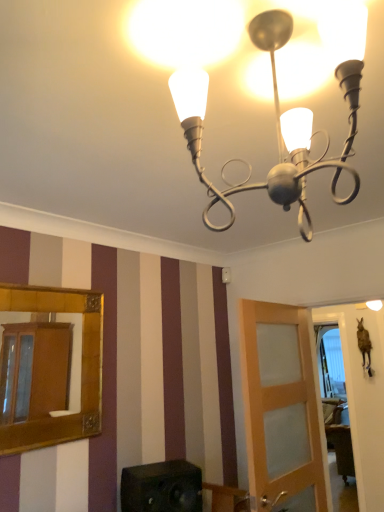
In order to face metallic silver chandelier at upper center, should I rotate leftwards or rightwards?

You should look right and rotate roughly 12.749 degrees.

Looking at this image, measure the distance between point (352, 115) and camera.

The depth of point (352, 115) is 29.53 inches.

In order to face transparent glass window at center, should I rotate leftwards or rightwards?

Rotate right and turn 18.726 degrees.

The image size is (384, 512). Identify the location of black matte speaker at lower center. (162, 487).

Between gold-framed mirror at left and black matte speaker at lower center, which one has less height?

black matte speaker at lower center.

From the image's perspective, between gold-framed mirror at left and black matte speaker at lower center, who is located below?

black matte speaker at lower center is shown below in the image.

Is gold-framed mirror at left touching black matte speaker at lower center?

No, gold-framed mirror at left is not next to black matte speaker at lower center.

Considering the points (38, 426) and (126, 488), which point is in front, point (38, 426) or point (126, 488)?

The point (126, 488) is in front.

Is black matte speaker at lower center taller than gold-framed mirror at left?

No, black matte speaker at lower center is not taller than gold-framed mirror at left.

What's the angular difference between black matte speaker at lower center and gold-framed mirror at left's facing directions?

black matte speaker at lower center and gold-framed mirror at left are facing 20.5 degrees away from each other.

Is black matte speaker at lower center outside of gold-framed mirror at left?

Absolutely, black matte speaker at lower center is external to gold-framed mirror at left.

Does metallic silver chandelier at upper center have a lesser height compared to gold-framed mirror at left?

Correct, metallic silver chandelier at upper center is not as tall as gold-framed mirror at left.

Is metallic silver chandelier at upper center at the left side of gold-framed mirror at left?

No.

Is metallic silver chandelier at upper center completely or partially outside of gold-framed mirror at left?

Yes.

Are metallic silver chandelier at upper center and gold-framed mirror at left located far from each other?

metallic silver chandelier at upper center is far away from gold-framed mirror at left.

Considering the positions of points (343, 20) and (258, 439), is point (343, 20) farther from camera compared to point (258, 439)?

No, it is not.

Is metallic silver chandelier at upper center looking in the opposite direction of light brown wooden door at center?

No, metallic silver chandelier at upper center is not facing the opposite direction of light brown wooden door at center.

Measure the distance from metallic silver chandelier at upper center to light brown wooden door at center.

metallic silver chandelier at upper center is 3.64 feet from light brown wooden door at center.

In the image, is metallic silver chandelier at upper center on the left side or the right side of light brown wooden door at center?

metallic silver chandelier at upper center is to the left of light brown wooden door at center.

Is light brown wooden door at center spatially inside gold-framed mirror at left, or outside of it?

light brown wooden door at center exists outside the volume of gold-framed mirror at left.

Is light brown wooden door at center next to gold-framed mirror at left and touching it?

light brown wooden door at center is not next to gold-framed mirror at left, and they're not touching.

Is metallic silver chandelier at upper center far from transparent glass window at center?

Yes, metallic silver chandelier at upper center and transparent glass window at center are located far from each other.

Would you say metallic silver chandelier at upper center contains transparent glass window at center?

No, transparent glass window at center is not surrounded by metallic silver chandelier at upper center.

Find the location of a particular element. lamp above the transparent glass window at center (from the image's perspective) is located at coordinates (276, 130).

Is transparent glass window at center oriented away from metallic silver chandelier at upper center?

transparent glass window at center is not turned away from metallic silver chandelier at upper center.

Considering the positions of points (332, 328) and (182, 106), is point (332, 328) farther from camera compared to point (182, 106)?

Yes.

Is the depth of transparent glass window at center less than that of metallic silver chandelier at upper center?

No, transparent glass window at center is further to the viewer.

How distant is transparent glass window at center from metallic silver chandelier at upper center?

They are 10.06 feet apart.

The width and height of the screenshot is (384, 512). I want to click on speaker that appears below the gold-framed mirror at left (from the image's perspective), so click(162, 487).

Where is `mirror that is in front of the black matte speaker at lower center`? This screenshot has width=384, height=512. mirror that is in front of the black matte speaker at lower center is located at coordinates (81, 368).

Estimate the real-world distances between objects in this image. Which object is closer to gold-framed mirror at left, light brown wooden door at center or transparent glass window at center?

light brown wooden door at center.

From the image, which object appears to be farther from black matte speaker at lower center, gold-framed mirror at left or metallic silver chandelier at upper center?

metallic silver chandelier at upper center is further to black matte speaker at lower center.

Based on their spatial positions, is gold-framed mirror at left or light brown wooden door at center closer to black matte speaker at lower center?

Among the two, gold-framed mirror at left is located nearer to black matte speaker at lower center.

Considering their positions, is light brown wooden door at center positioned further to metallic silver chandelier at upper center than transparent glass window at center?

transparent glass window at center lies further to metallic silver chandelier at upper center than the other object.

Based on their spatial positions, is transparent glass window at center or metallic silver chandelier at upper center further from light brown wooden door at center?

transparent glass window at center is further to light brown wooden door at center.

Based on their spatial positions, is metallic silver chandelier at upper center or black matte speaker at lower center closer to gold-framed mirror at left?

Among the two, black matte speaker at lower center is located nearer to gold-framed mirror at left.

From the image, which object appears to be farther from light brown wooden door at center, black matte speaker at lower center or metallic silver chandelier at upper center?

metallic silver chandelier at upper center.

Which object lies further to the anchor point metallic silver chandelier at upper center, transparent glass window at center or black matte speaker at lower center?

transparent glass window at center is further to metallic silver chandelier at upper center.

At what (x,y) coordinates should I click in order to perform the action: click on speaker between gold-framed mirror at left and light brown wooden door at center from left to right. Please return your answer as a coordinate pair (x, y). The height and width of the screenshot is (512, 384). Looking at the image, I should click on (162, 487).

Where is `mirror between metallic silver chandelier at upper center and transparent glass window at center from front to back`? The width and height of the screenshot is (384, 512). mirror between metallic silver chandelier at upper center and transparent glass window at center from front to back is located at coordinates (81, 368).

You are a GUI agent. You are given a task and a screenshot of the screen. Output one action in this format:
    pyautogui.click(x=<x>, y=<y>)
    Task: Click on the door between black matte speaker at lower center and transparent glass window at center from front to back
    The width and height of the screenshot is (384, 512).
    Given the screenshot: What is the action you would take?
    pyautogui.click(x=281, y=405)

In order to click on door between metallic silver chandelier at upper center and black matte speaker at lower center from top to bottom in this screenshot , I will do `click(281, 405)`.